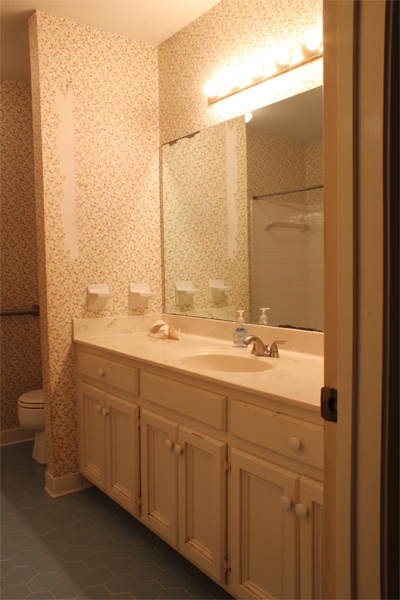
At what (x,y) coordinates should I click in order to perform the action: click on dispenser. Please return your answer as a coordinate pair (x, y). The width and height of the screenshot is (400, 600). Looking at the image, I should click on (240, 332).